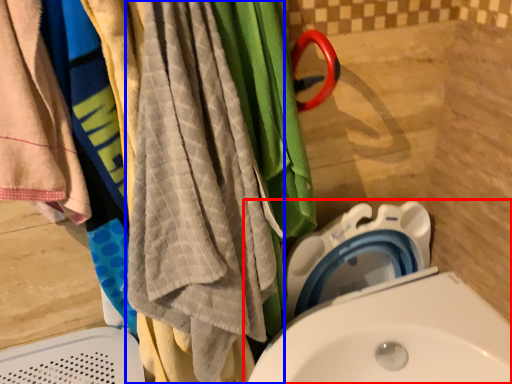
Question: Which point is closer to the camera, toilet (highlighted by a red box) or beach towel (highlighted by a blue box)?

Choices:
 (A) toilet
 (B) beach towel

Answer: (B)